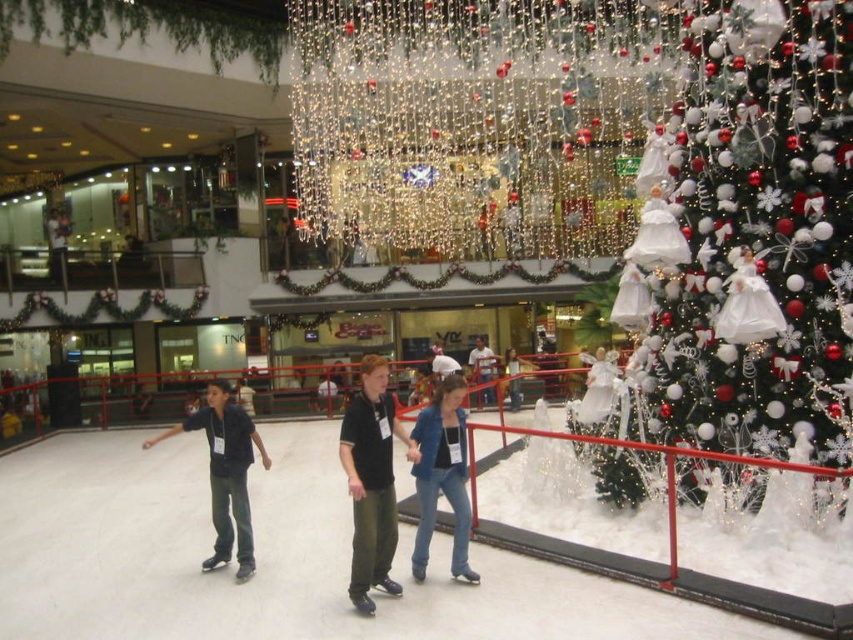
Does point (265, 461) lie behind point (494, 369)?

No.

Can you confirm if dark blue jeans at center is positioned below matte black jacket at center?

Yes.

Is point (248, 566) less distant than point (480, 337)?

Yes, it is in front of point (480, 337).

Where is `dark blue jeans at center`? dark blue jeans at center is located at coordinates coord(225,472).

Can you confirm if white glittering tree at upper right is smaller than blue denim jeans at center?

Incorrect, white glittering tree at upper right is not smaller in size than blue denim jeans at center.

Who is more forward, (x=836, y=140) or (x=506, y=353)?

Point (x=836, y=140) is in front.

Where is `white glittering tree at upper right`? The width and height of the screenshot is (853, 640). white glittering tree at upper right is located at coordinates (758, 237).

What do you see at coordinates (370, 481) in the screenshot? The height and width of the screenshot is (640, 853). I see `black matte shirt at center` at bounding box center [370, 481].

Is black matte shirt at center above dark blue jeans at center?

Yes, black matte shirt at center is above dark blue jeans at center.

The image size is (853, 640). Find the location of `black matte shirt at center`. black matte shirt at center is located at coordinates (370, 481).

In order to click on black matte shirt at center in this screenshot , I will do `click(370, 481)`.